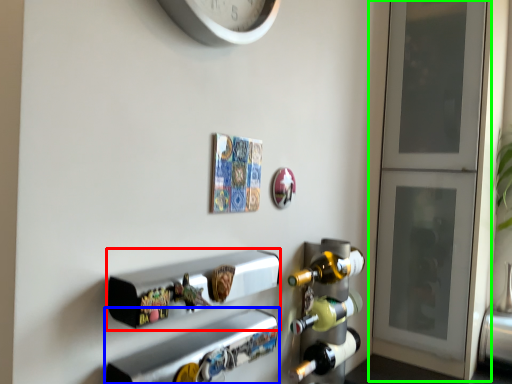
Question: Which is farther away from shelf (highlighted by a red box)? shelf (highlighted by a blue box) or door (highlighted by a green box)?

Choices:
 (A) shelf
 (B) door

Answer: (B)